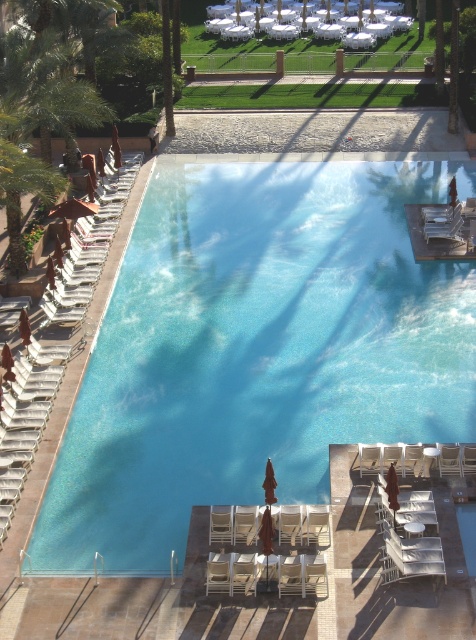
Question: Considering the relative positions of green leafy palm tree at left and beige fabric beach chair at lower center in the image provided, where is green leafy palm tree at left located with respect to beige fabric beach chair at lower center?

Choices:
 (A) left
 (B) right

Answer: (A)

Question: Does clear glass swimming pool at center have a smaller size compared to beige fabric beach chair at lower center?

Choices:
 (A) no
 (B) yes

Answer: (A)

Question: Based on their relative distances, which object is farther from the clear glass swimming pool at center?

Choices:
 (A) green leafy palm tree at left
 (B) beige fabric beach chair at lower center

Answer: (A)

Question: Does green leafy palm tree at left have a smaller size compared to beige fabric beach chair at lower center?

Choices:
 (A) yes
 (B) no

Answer: (B)

Question: Based on their relative distances, which object is farther from the clear glass swimming pool at center?

Choices:
 (A) beige fabric beach chair at lower center
 (B) green leafy palm tree at left

Answer: (B)

Question: Which object is closer to the camera taking this photo?

Choices:
 (A) clear glass swimming pool at center
 (B) green leafy palm tree at left
 (C) beige fabric beach chair at lower center

Answer: (C)